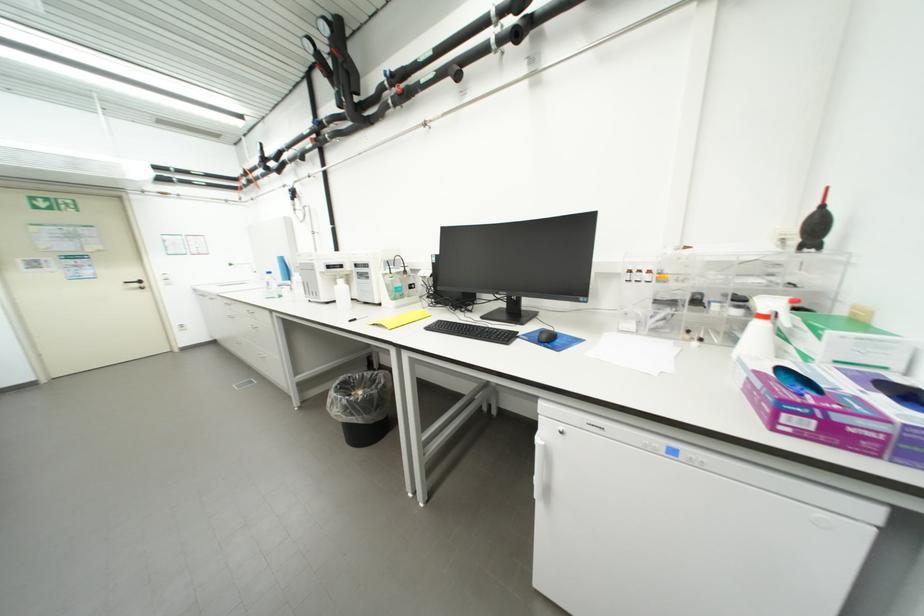
Which object does [761,329] point to?

It corresponds to the white spray bottle in the image.